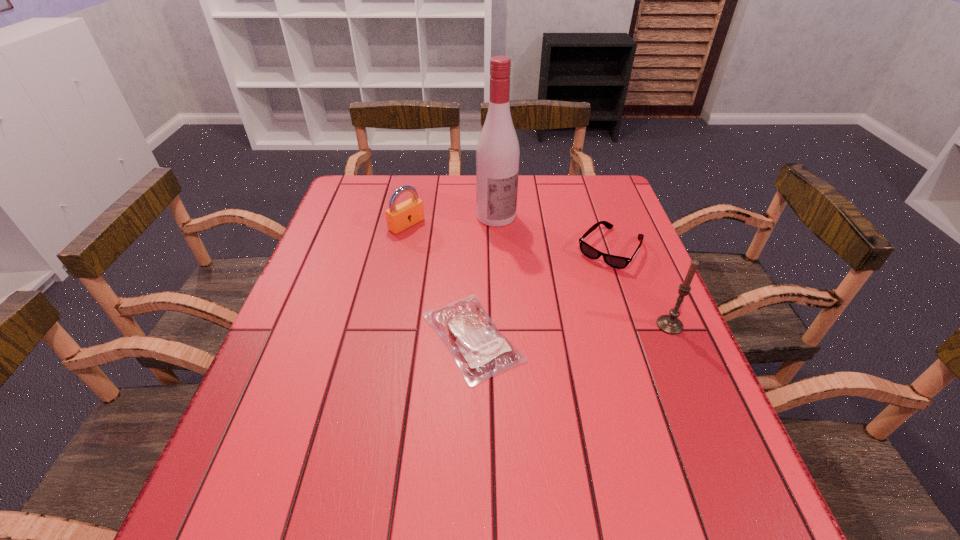
Image resolution: width=960 pixels, height=540 pixels. In order to click on vacant space in between the third tallest object and the fourth tallest object in this screenshot , I will do `click(508, 237)`.

Image resolution: width=960 pixels, height=540 pixels. In order to click on empty space between the third tallest object and the steak in this screenshot , I will do `click(440, 281)`.

Image resolution: width=960 pixels, height=540 pixels. What are the coordinates of `free space between the steak and the third tallest object` in the screenshot? It's located at (440, 281).

The height and width of the screenshot is (540, 960). I want to click on vacant area that lies between the candle and the shortest object, so click(x=571, y=331).

Locate an element on the screen. The width and height of the screenshot is (960, 540). vacant area that lies between the candle and the fourth tallest object is located at coordinates (639, 287).

Where is `free space between the fourth shortest object and the steak`? The image size is (960, 540). free space between the fourth shortest object and the steak is located at coordinates (571, 331).

At what (x,y) coordinates should I click in order to perform the action: click on the second closest object to the shortest object. Please return your answer as a coordinate pair (x, y). The height and width of the screenshot is (540, 960). Looking at the image, I should click on (399, 217).

You are a GUI agent. You are given a task and a screenshot of the screen. Output one action in this format:
    pyautogui.click(x=<x>, y=<y>)
    Task: Click on the fourth closest object relative to the tallest object
    This screenshot has width=960, height=540.
    Given the screenshot: What is the action you would take?
    pyautogui.click(x=670, y=324)

Locate an element on the screen. The image size is (960, 540). free spot that satisfies the following two spatial constraints: 1. on the front side of the sunglasses; 2. on the left side of the third shortest object is located at coordinates (401, 249).

Locate an element on the screen. The image size is (960, 540). free location that satisfies the following two spatial constraints: 1. on the back side of the fourth tallest object; 2. on the left side of the steak is located at coordinates (474, 249).